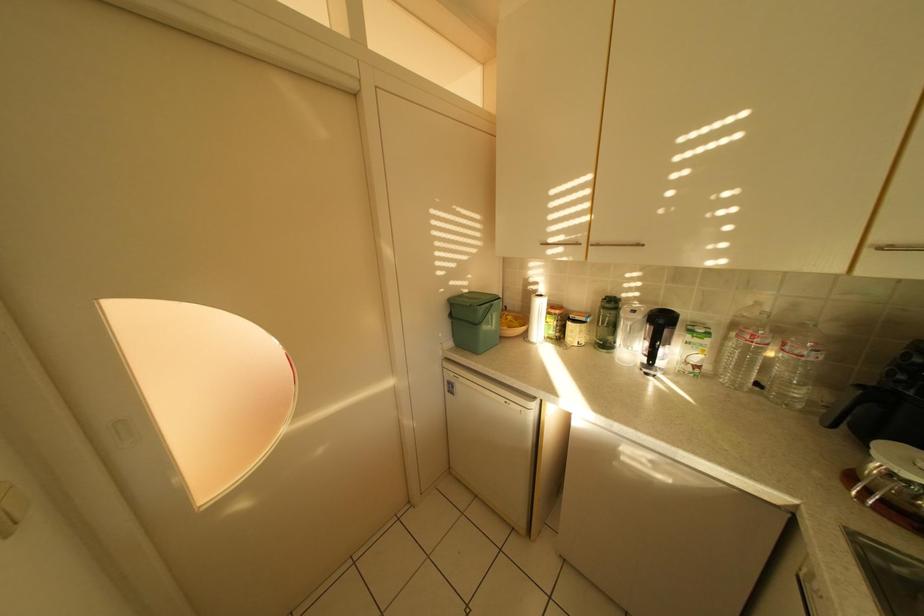
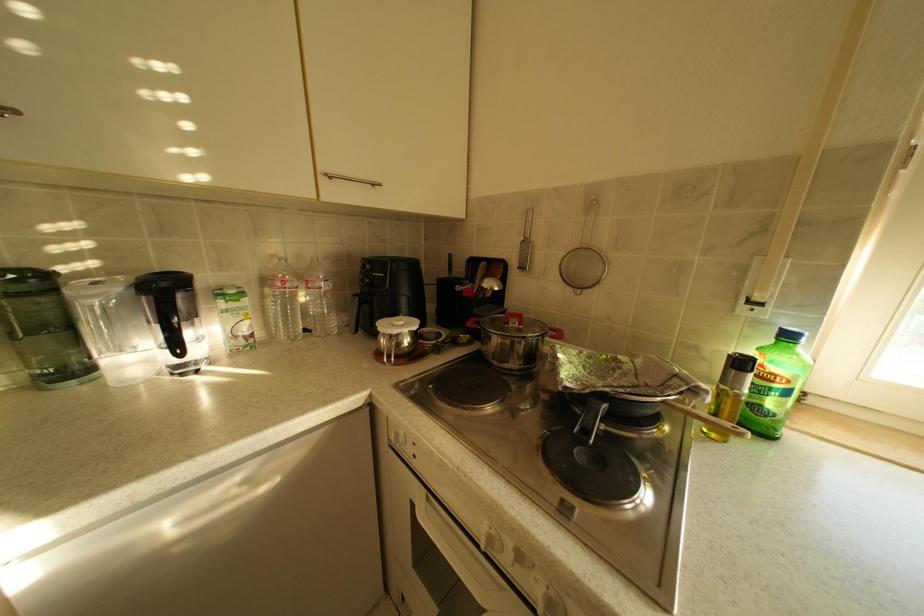
Question: The first image is from the beginning of the video and the second image is from the end. How did the camera likely rotate when shooting the video?

Choices:
 (A) Left
 (B) Right
 (C) Up
 (D) Down

Answer: (B)